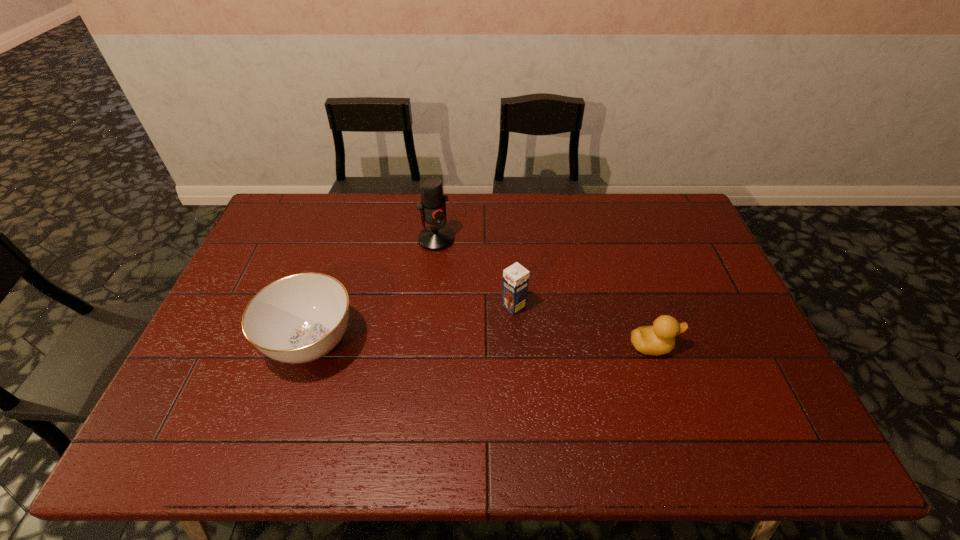
The width and height of the screenshot is (960, 540). Find the location of `free point located on the side of the tallest object with the red ring`. free point located on the side of the tallest object with the red ring is located at coordinates (486, 308).

At what (x,y) coordinates should I click in order to perform the action: click on free region located 0.360m on the front label of the third object from left to right. Please return your answer as a coordinate pair (x, y). Image resolution: width=960 pixels, height=540 pixels. Looking at the image, I should click on (397, 383).

The width and height of the screenshot is (960, 540). Find the location of `vacant space situated 0.090m on the front label of the third object from left to right`. vacant space situated 0.090m on the front label of the third object from left to right is located at coordinates (481, 328).

Identify the location of vacant area located 0.240m on the front label of the third object from left to right. This screenshot has width=960, height=540. (437, 357).

In order to click on object at the far edge in this screenshot , I will do `click(432, 207)`.

You are a GUI agent. You are given a task and a screenshot of the screen. Output one action in this format:
    pyautogui.click(x=<x>, y=<y>)
    Task: Click on the object that is at the near edge
    This screenshot has height=540, width=960.
    Given the screenshot: What is the action you would take?
    pyautogui.click(x=300, y=318)

You are a GUI agent. You are given a task and a screenshot of the screen. Output one action in this format:
    pyautogui.click(x=<x>, y=<y>)
    Task: Click on the object present at the left edge
    The image size is (960, 540).
    Given the screenshot: What is the action you would take?
    click(x=300, y=318)

The height and width of the screenshot is (540, 960). Find the location of `object positioned at the near left corner`. object positioned at the near left corner is located at coordinates (300, 318).

Find the location of `vacant space at the far edge of the desktop`. vacant space at the far edge of the desktop is located at coordinates (535, 207).

Find the location of a particular element. vacant space at the near edge of the desktop is located at coordinates (411, 394).